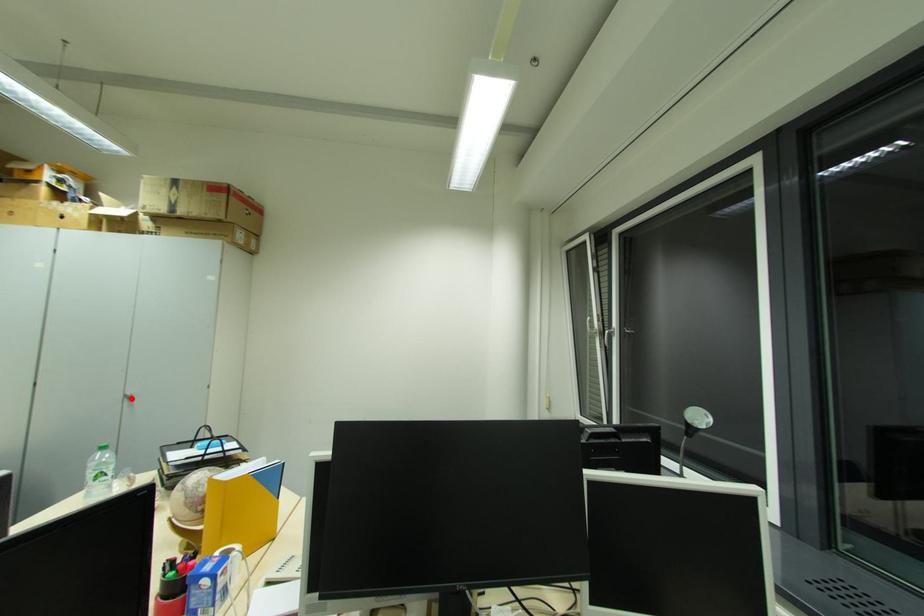
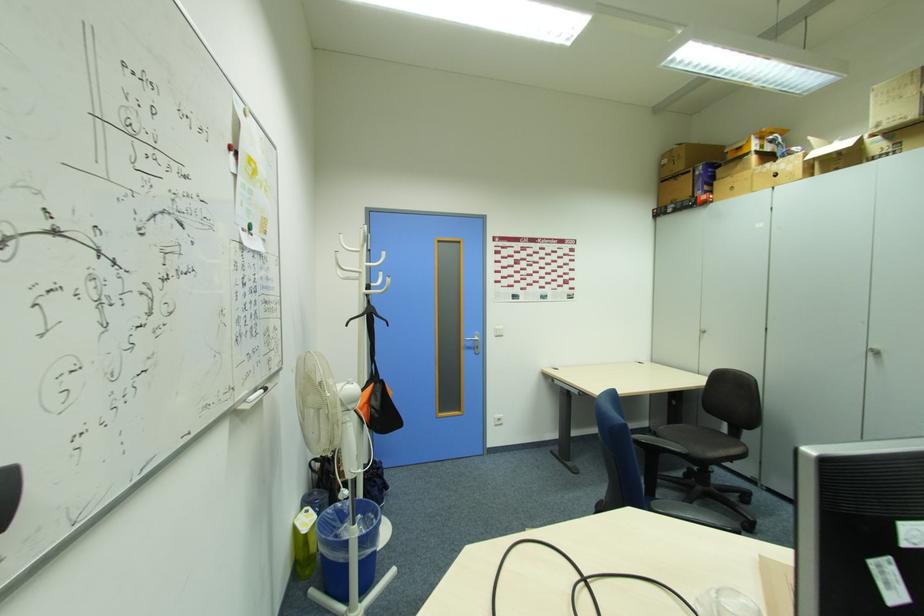
Find the pixel in the second image that matches the highlighted location in the first image.

(880, 354)